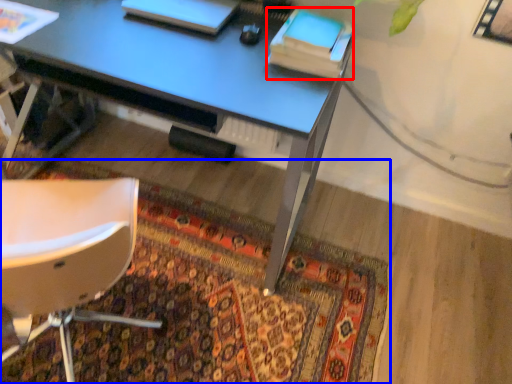
Question: Which of the following is the closest to the observer, book (highlighted by a red box) or mat (highlighted by a blue box)?

Choices:
 (A) book
 (B) mat

Answer: (B)